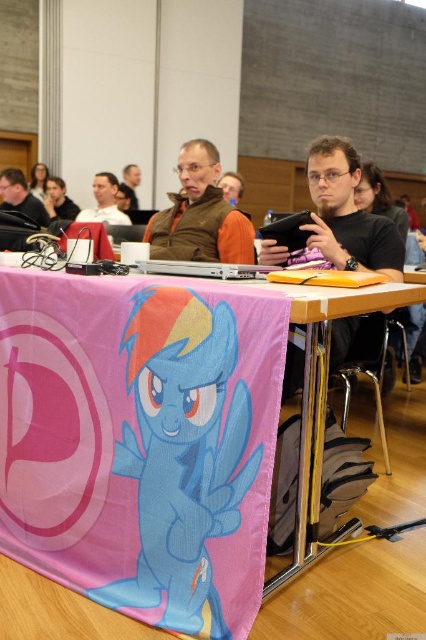
You are a photographer standing at the camera position. You want to take a photo of the matte black tablet at center. However, there is a requirement that the tablet must be at least 4 feet away from the camera to avoid distortion. Can you take the photo as required?

The matte black tablet at center is only 3.52 feet from the camera, which is less than the required 4 feet. Therefore, you cannot take the photo as required without moving closer or adjusting the camera setup.

You are organizing the items on the table and need to place the matte black tablet at center. Where exactly should you position it?

The matte black tablet at center should be positioned at coordinates point [347,212].

You are standing in the conference room and want to reach the point at coordinates (347,193) on the table. The table is 2 meters long. Can you walk around the table to reach that point?

The point at coordinates (347,193) is 2.22 meters away from the camera, so you need to move forward approximately 2.22 meters to reach it. Since the table is only 2 meters long, you might not be able to walk around it easily without encountering obstacles. Consider moving around the sides or adjusting your path accordingly.